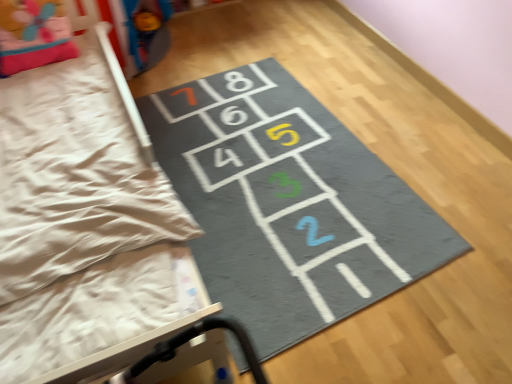
Locate an element on the screen. The width and height of the screenshot is (512, 384). gray fabric hopscotch at center is located at coordinates (289, 204).

The image size is (512, 384). What do you see at coordinates (289, 204) in the screenshot?
I see `gray fabric hopscotch at center` at bounding box center [289, 204].

What do you see at coordinates (33, 35) in the screenshot? The height and width of the screenshot is (384, 512). I see `pink fabric pillow at upper left` at bounding box center [33, 35].

The height and width of the screenshot is (384, 512). What are the coordinates of `pink fabric pillow at upper left` in the screenshot? It's located at (33, 35).

Find the location of a particular element. The width and height of the screenshot is (512, 384). gray fabric hopscotch at center is located at coordinates (289, 204).

Considering the relative positions of pink fabric pillow at upper left and gray fabric hopscotch at center in the image provided, is pink fabric pillow at upper left to the left or to the right of gray fabric hopscotch at center?

Clearly, pink fabric pillow at upper left is on the left of gray fabric hopscotch at center in the image.

Is pink fabric pillow at upper left further to the viewer compared to gray fabric hopscotch at center?

Yes, pink fabric pillow at upper left is further from the viewer.

Does point (6, 32) come closer to viewer compared to point (303, 336)?

No, it is not.

From the image's perspective, is pink fabric pillow at upper left positioned above or below gray fabric hopscotch at center?

Clearly, from the image's perspective, pink fabric pillow at upper left is above gray fabric hopscotch at center.

From a real-world perspective, is pink fabric pillow at upper left positioned above or below gray fabric hopscotch at center?

Clearly, from a real-world perspective, pink fabric pillow at upper left is above gray fabric hopscotch at center.

Which of these two, pink fabric pillow at upper left or gray fabric hopscotch at center, is wider?

With larger width is gray fabric hopscotch at center.

Is pink fabric pillow at upper left shorter than gray fabric hopscotch at center?

In fact, pink fabric pillow at upper left may be taller than gray fabric hopscotch at center.

Can you confirm if pink fabric pillow at upper left is smaller than gray fabric hopscotch at center?

Correct, pink fabric pillow at upper left occupies less space than gray fabric hopscotch at center.

Is pink fabric pillow at upper left positioned beyond the bounds of gray fabric hopscotch at center?

Yes, pink fabric pillow at upper left is outside of gray fabric hopscotch at center.

Are pink fabric pillow at upper left and gray fabric hopscotch at center far apart?

No, there isn't a large distance between pink fabric pillow at upper left and gray fabric hopscotch at center.

Consider the image. Is pink fabric pillow at upper left facing away from gray fabric hopscotch at center?

No, gray fabric hopscotch at center is not at the back of pink fabric pillow at upper left.

Locate an element on the screen. pillow on the left of gray fabric hopscotch at center is located at coordinates (33, 35).

Visually, is gray fabric hopscotch at center positioned to the left or to the right of pink fabric pillow at upper left?

From the image, it's evident that gray fabric hopscotch at center is to the right of pink fabric pillow at upper left.

Is gray fabric hopscotch at center further to camera compared to pink fabric pillow at upper left?

No, gray fabric hopscotch at center is closer to the camera.

Is point (289, 311) farther from viewer compared to point (0, 28)?

No, it is in front of (0, 28).

Looking at this image, from the image's perspective, which is below, gray fabric hopscotch at center or pink fabric pillow at upper left?

gray fabric hopscotch at center, from the image's perspective.

From a real-world perspective, which is physically above, gray fabric hopscotch at center or pink fabric pillow at upper left?

A: pink fabric pillow at upper left, from a real-world perspective.

Looking at this image, looking at their sizes, would you say gray fabric hopscotch at center is wider or thinner than pink fabric pillow at upper left?

gray fabric hopscotch at center is wider than pink fabric pillow at upper left.

Can you confirm if gray fabric hopscotch at center is taller than pink fabric pillow at upper left?

In fact, gray fabric hopscotch at center may be shorter than pink fabric pillow at upper left.

From the picture: Can you confirm if gray fabric hopscotch at center is bigger than pink fabric pillow at upper left?

Correct, gray fabric hopscotch at center is larger in size than pink fabric pillow at upper left.

Does gray fabric hopscotch at center contain pink fabric pillow at upper left?

That's incorrect, pink fabric pillow at upper left is not inside gray fabric hopscotch at center.

Is gray fabric hopscotch at center far away from pink fabric pillow at upper left?

No, there isn't a large distance between gray fabric hopscotch at center and pink fabric pillow at upper left.

Is gray fabric hopscotch at center oriented towards pink fabric pillow at upper left?

No, gray fabric hopscotch at center does not turn towards pink fabric pillow at upper left.

What's the angular difference between gray fabric hopscotch at center and pink fabric pillow at upper left's facing directions?

The facing directions of gray fabric hopscotch at center and pink fabric pillow at upper left are 92.8 degrees apart.

How much distance is there between gray fabric hopscotch at center and pink fabric pillow at upper left?

gray fabric hopscotch at center is 37.37 inches away from pink fabric pillow at upper left.

In order to click on yoga mat below the pink fabric pillow at upper left (from a real-world perspective) in this screenshot , I will do `click(289, 204)`.

What are the coordinates of `yoga mat below the pink fabric pillow at upper left (from a real-world perspective)` in the screenshot? It's located at (289, 204).

At what (x,y) coordinates should I click in order to perform the action: click on yoga mat in front of the pink fabric pillow at upper left. Please return your answer as a coordinate pair (x, y). Looking at the image, I should click on (289, 204).